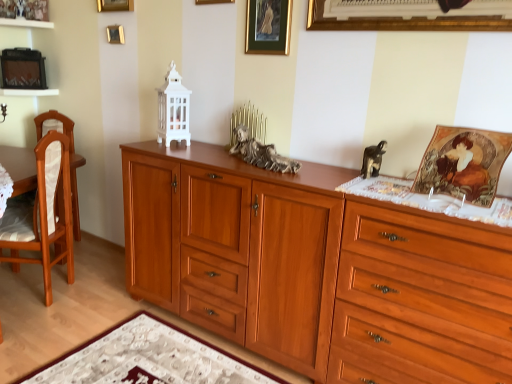
Identify the location of free space in front of black glossy monkey at upper right, the first animal when ordered from right to left. This screenshot has height=384, width=512. (381, 190).